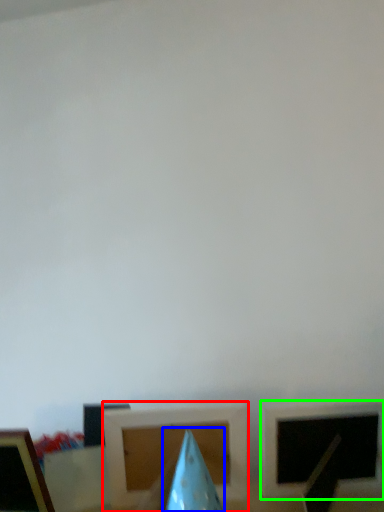
Question: Which object is positioned closest to picture frame (highlighted by a red box)? Select from exhaust hood (highlighted by a blue box) and picture frame (highlighted by a green box).

Choices:
 (A) exhaust hood
 (B) picture frame

Answer: (A)